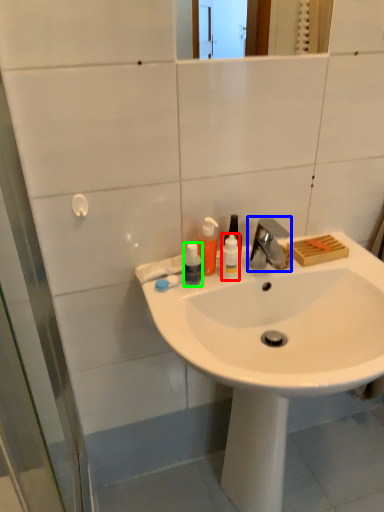
Question: Based on their relative distances, which object is nearer to bottle (highlighted by a red box)? Choose from tap (highlighted by a blue box) and bottle (highlighted by a green box).

Choices:
 (A) tap
 (B) bottle

Answer: (B)